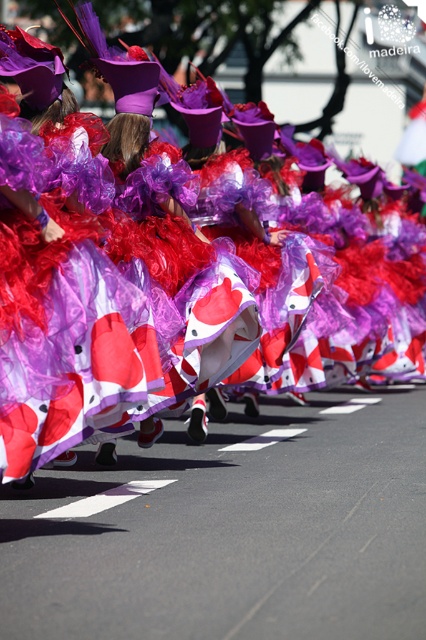
Question: Which of the following is the farthest from the observer?

Choices:
 (A) (135, 492)
 (B) (63, 403)

Answer: (A)

Question: Does matte purple fabric at center come in front of white solid line at center?

Choices:
 (A) yes
 (B) no

Answer: (A)

Question: Among these points, which one is farthest from the camera?

Choices:
 (A) (23, 272)
 (B) (150, 486)

Answer: (B)

Question: Which point appears closest to the camera in this image?

Choices:
 (A) (88, 429)
 (B) (74, 512)

Answer: (A)

Question: Is matte purple fabric at center positioned before white solid line at center?

Choices:
 (A) no
 (B) yes

Answer: (B)

Question: Is matte purple fabric at center to the left of white solid line at center from the viewer's perspective?

Choices:
 (A) yes
 (B) no

Answer: (A)